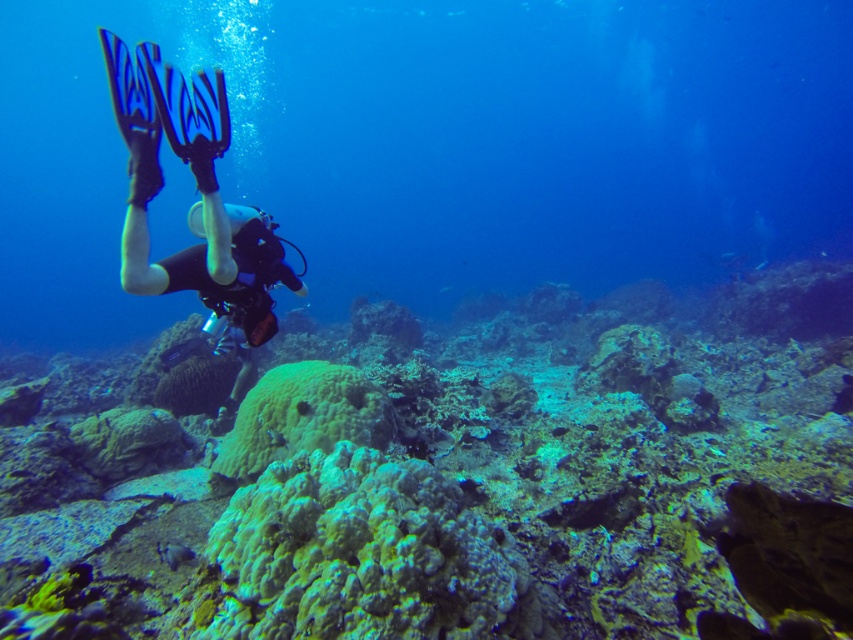
Does green coral reef at center come in front of green porous coral at center?

Yes, green coral reef at center is closer to the viewer.

The height and width of the screenshot is (640, 853). What do you see at coordinates (448, 476) in the screenshot?
I see `green coral reef at center` at bounding box center [448, 476].

What are the coordinates of `green coral reef at center` in the screenshot? It's located at (448, 476).

Find the location of `green coral reef at center`. green coral reef at center is located at coordinates (448, 476).

You are a GUI agent. You are given a task and a screenshot of the screen. Output one action in this format:
    pyautogui.click(x=<x>, y=<y>)
    Task: Click on the green coral reef at center
    Image resolution: width=853 pixels, height=640 pixels.
    Given the screenshot: What is the action you would take?
    pyautogui.click(x=448, y=476)

Which is above, green coral reef at center or black matte scuba diver at left?

black matte scuba diver at left

Does point (221, 396) come in front of point (189, 269)?

No, (221, 396) is further to viewer.

You are a GUI agent. You are given a task and a screenshot of the screen. Output one action in this format:
    pyautogui.click(x=<x>, y=<y>)
    Task: Click on the green coral reef at center
    The width and height of the screenshot is (853, 640).
    Given the screenshot: What is the action you would take?
    pyautogui.click(x=448, y=476)

Between black matte scuba diver at left and green matte coral at center, which one appears on the right side from the viewer's perspective?

Positioned to the right is green matte coral at center.

The image size is (853, 640). Find the location of `black matte scuba diver at left`. black matte scuba diver at left is located at coordinates (201, 243).